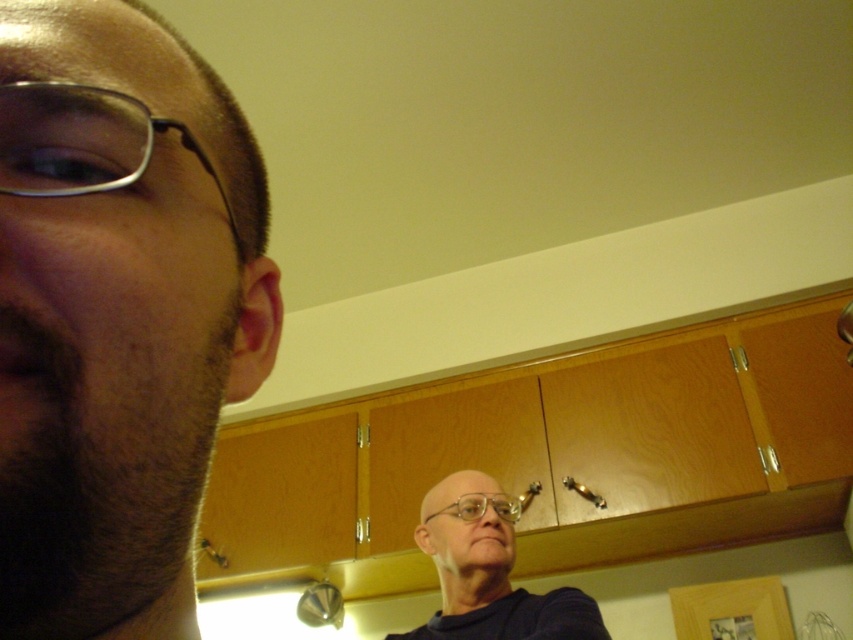
Question: Does bald head at upper center have a lesser width compared to transparent plastic glasses at center?

Choices:
 (A) no
 (B) yes

Answer: (A)

Question: Does metallic frame glasses at left appear on the left side of transparent plastic glasses at center?

Choices:
 (A) yes
 (B) no

Answer: (A)

Question: Is bald head at upper center below metallic frame glasses at left?

Choices:
 (A) no
 (B) yes

Answer: (B)

Question: Which is farther from the beige matte skin at upper left?

Choices:
 (A) bald head at upper center
 (B) metallic frame glasses at left

Answer: (A)

Question: Based on their relative distances, which object is nearer to the beige matte skin at upper left?

Choices:
 (A) bald head at upper center
 (B) transparent plastic glasses at center
 (C) metallic frame glasses at left

Answer: (C)

Question: Which object is the farthest from the beige matte skin at upper left?

Choices:
 (A) bald head at upper center
 (B) transparent plastic glasses at center

Answer: (B)